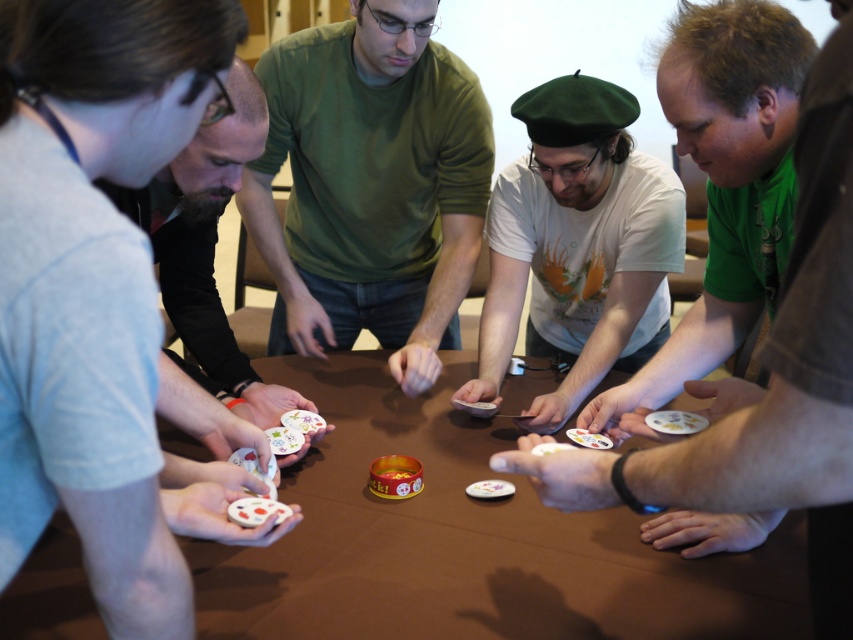
Question: Which object is closer to the camera taking this photo?

Choices:
 (A) white matte beret at center
 (B) smooth gray shirt at left

Answer: (B)

Question: Which point is closer to the camera?

Choices:
 (A) smooth gray shirt at left
 (B) white matte beret at center
 (C) brown matte table at center
 (D) green matte shirt at center

Answer: (C)

Question: Does white matte beret at center appear on the right side of smooth gray shirt at left?

Choices:
 (A) yes
 (B) no

Answer: (A)

Question: Is white matte beret at center to the right of smooth gray shirt at left from the viewer's perspective?

Choices:
 (A) no
 (B) yes

Answer: (B)

Question: Can you confirm if green matte shirt at center is bigger than smooth gray shirt at left?

Choices:
 (A) no
 (B) yes

Answer: (B)

Question: Considering the real-world distances, which object is farthest from the smooth gray shirt at left?

Choices:
 (A) green matte shirt at center
 (B) brown matte table at center
 (C) white matte beret at center

Answer: (C)